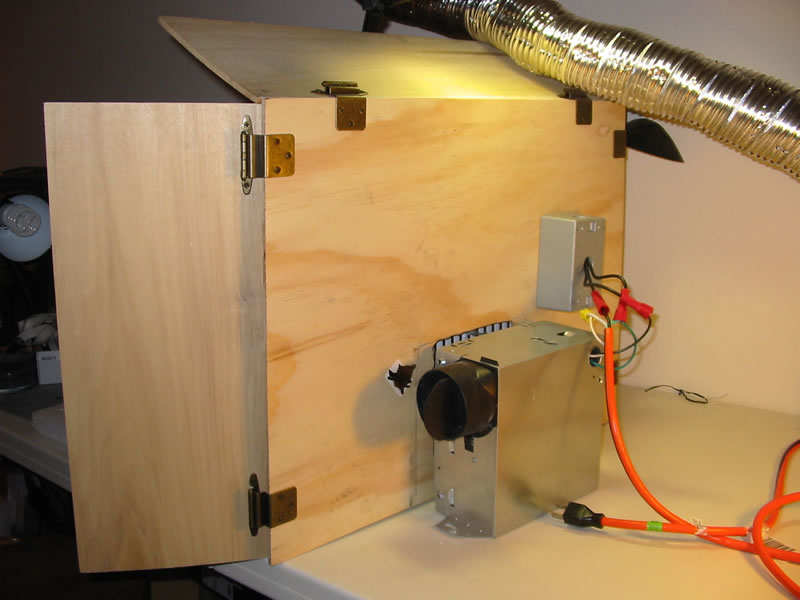
Locate an element on the screen. Image resolution: width=800 pixels, height=600 pixels. wall is located at coordinates (738, 291).